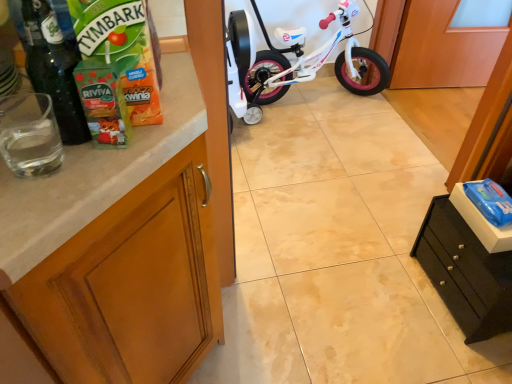
Question: Looking at the image, does wooden cabinet at left, which is the second cabinetry in right-to-left order, seem bigger or smaller compared to black matte drawer at lower right, the first cabinetry positioned from the right?

Choices:
 (A) small
 (B) big

Answer: (B)

Question: From the image's perspective, is wooden cabinet at left, marked as the first cabinetry in a left-to-right arrangement, located above or below black matte drawer at lower right, positioned as the second cabinetry in left-to-right order?

Choices:
 (A) above
 (B) below

Answer: (B)

Question: Which is farther from the wooden cabinet at left, which is the second cabinetry in right-to-left order?

Choices:
 (A) white glossy bicycle at center
 (B) black matte drawer at lower right, the first cabinetry positioned from the right

Answer: (A)

Question: Estimate the real-world distances between objects in this image. Which object is closer to the wooden cabinet at left, marked as the first cabinetry in a left-to-right arrangement?

Choices:
 (A) white glossy bicycle at center
 (B) black matte drawer at lower right, positioned as the second cabinetry in left-to-right order

Answer: (B)